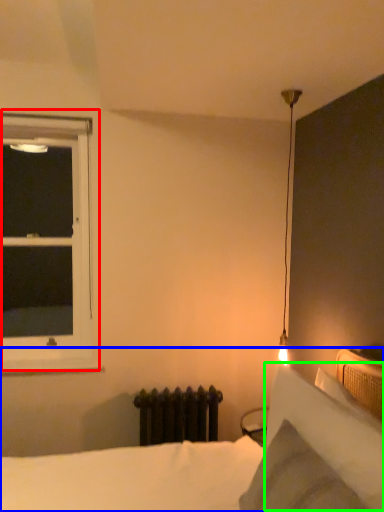
Question: Which object is positioned closest to window (highlighted by a red box)? Select from bed (highlighted by a blue box) and pillow (highlighted by a green box).

Choices:
 (A) bed
 (B) pillow

Answer: (A)